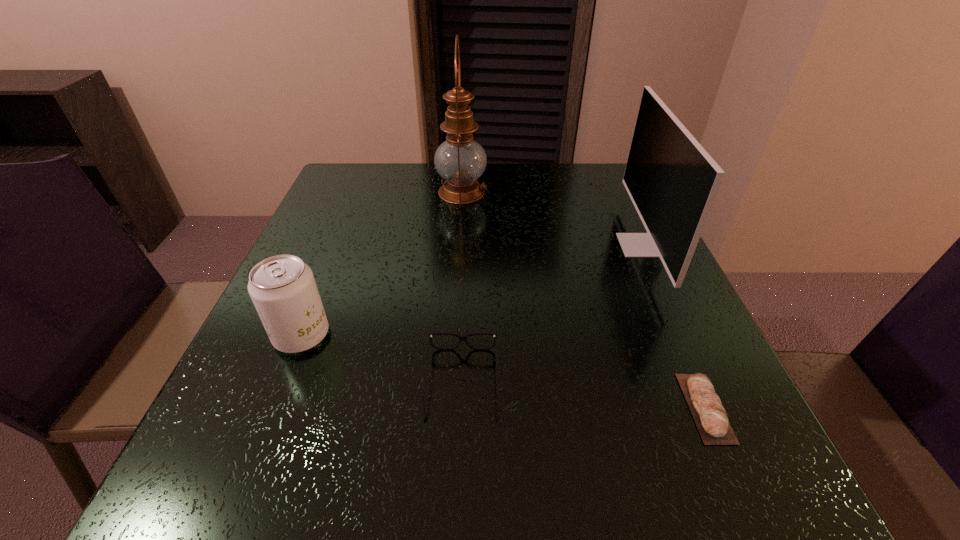
Find the location of a particular element. The width and height of the screenshot is (960, 540). vacant space located on the back of the third tallest object is located at coordinates (338, 247).

Locate an element on the screen. Image resolution: width=960 pixels, height=540 pixels. free space located with the lenses facing outward on the spectacles is located at coordinates (460, 461).

What are the coordinates of `free space located on the left of the pita bread` in the screenshot? It's located at (448, 408).

At what (x,y) coordinates should I click in order to perform the action: click on oil lamp that is at the far edge. Please return your answer as a coordinate pair (x, y). Looking at the image, I should click on (460, 160).

The image size is (960, 540). In order to click on monitor at the far edge in this screenshot , I will do `click(672, 181)`.

Locate an element on the screen. The image size is (960, 540). object situated at the left edge is located at coordinates 283,289.

You are a GUI agent. You are given a task and a screenshot of the screen. Output one action in this format:
    pyautogui.click(x=<x>, y=<y>)
    Task: Click on the monitor located at the right edge
    The width and height of the screenshot is (960, 540).
    Given the screenshot: What is the action you would take?
    pyautogui.click(x=672, y=181)

The height and width of the screenshot is (540, 960). Identify the location of pita bread present at the right edge. (710, 417).

Where is `object positioned at the far right corner`? object positioned at the far right corner is located at coordinates (672, 181).

In the image, there is a desktop. Identify the location of free region at the far edge. The width and height of the screenshot is (960, 540). (417, 173).